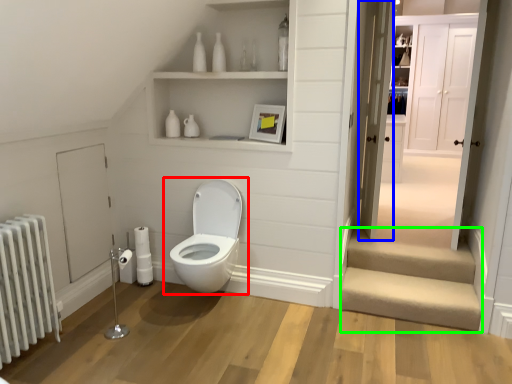
Question: Based on their relative distances, which object is nearer to toilet (highlighted by a red box)? Choose from door (highlighted by a blue box) and stairwell (highlighted by a green box).

Choices:
 (A) door
 (B) stairwell

Answer: (B)